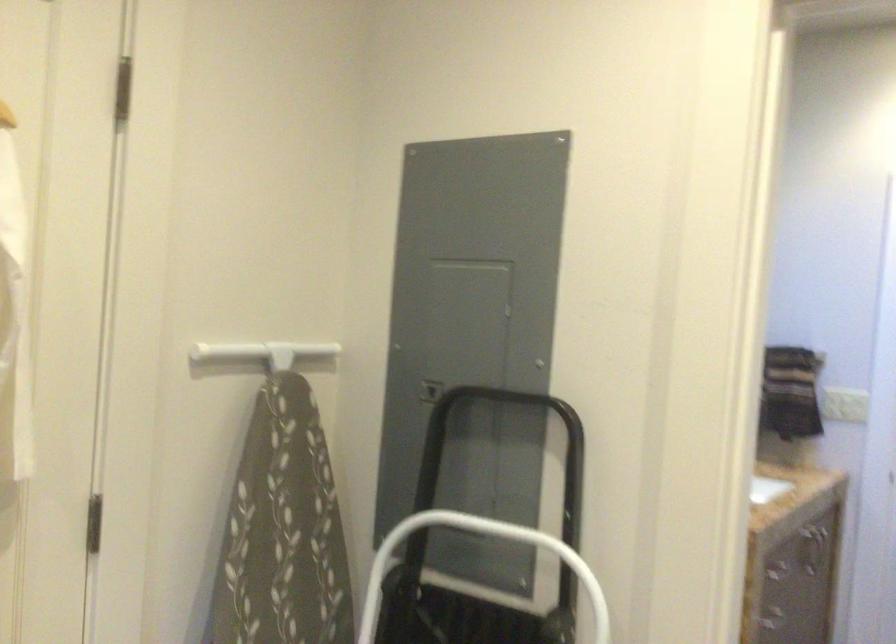
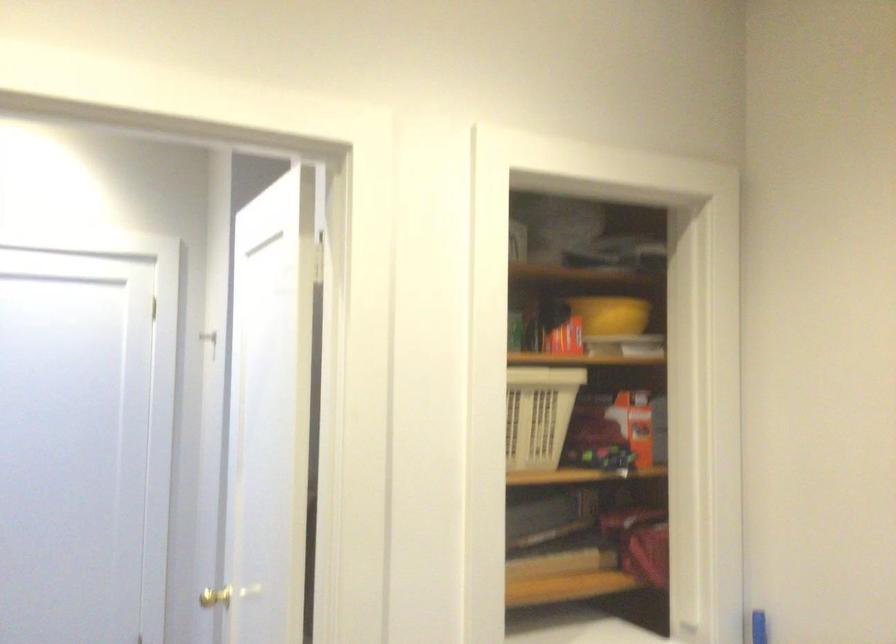
Question: Based on the continuous images, in which direction is the camera rotating? Reply with the corresponding letter.

Choices:
 (A) Left
 (B) Right
 (C) Up
 (D) Down

Answer: (B)